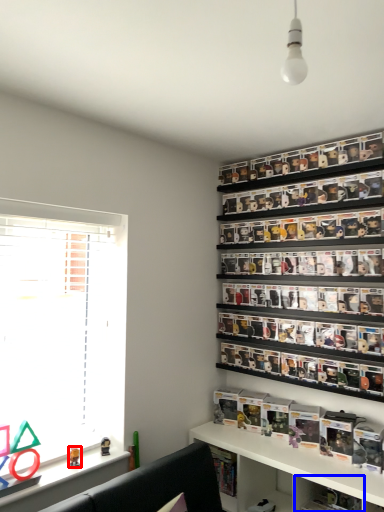
Question: Which of the following is the farthest to the observer, toy (highlighted by a red box) or cabinet (highlighted by a blue box)?

Choices:
 (A) toy
 (B) cabinet

Answer: (B)